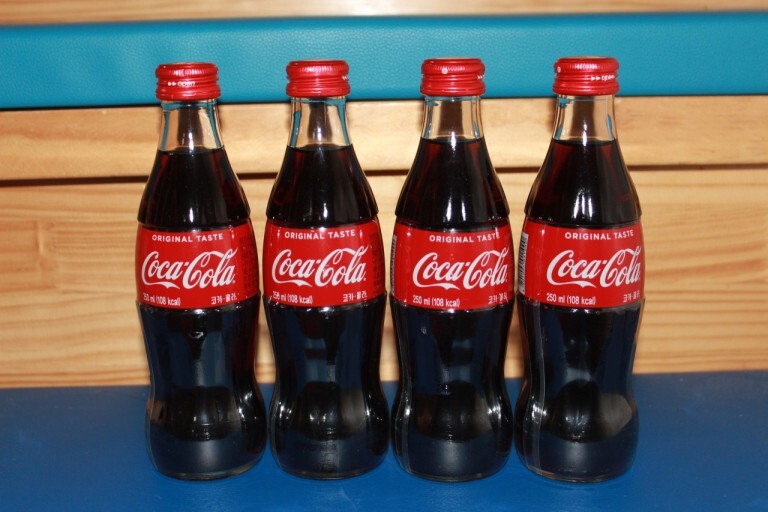
Image resolution: width=768 pixels, height=512 pixels. Identify the location of bottles. (194, 372), (308, 306), (434, 319), (574, 336).